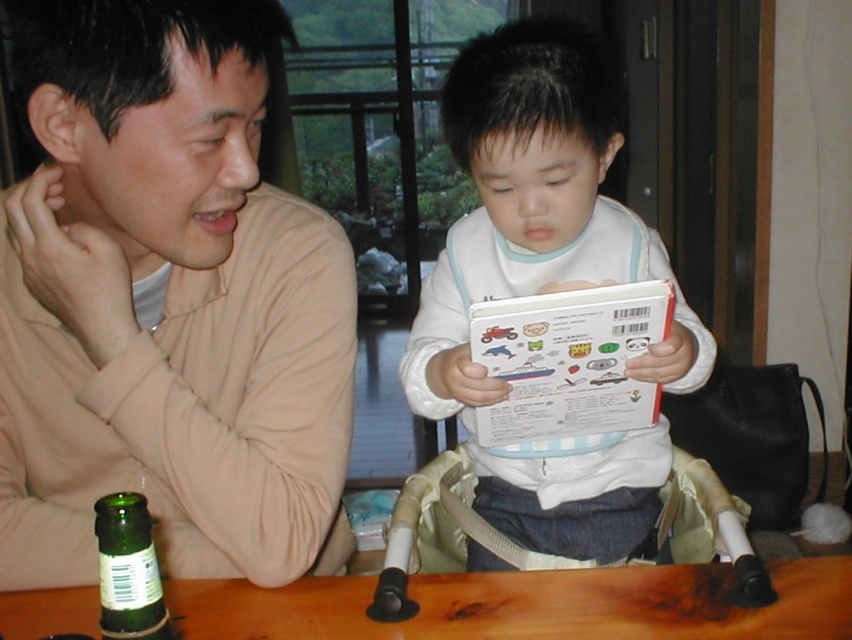
You are a photographer trying to capture a candid shot of the scene. You need to ensure that both the white matte book at center and the wooden table at lower center are clearly visible. Which object should you focus on first to ensure the other remains in focus?

The white matte book at center is positioned over wooden table at lower center. By focusing on the wooden table at lower center, which is further away, the white matte book at center will also be in focus since it is closer to the camera. Alternatively, focusing on the white matte book at center might risk the wooden table at lower center being slightly out of focus due to its distance.

You are a delivery person who needs to place a small package between the wooden table at lower center and the green glass bottle at lower left. Is there enough space for the package if it measures 25 centimeters in length?

The wooden table at lower center is 27.02 centimeters from the green glass bottle at lower left. Since the package is 25 centimeters long, there is sufficient space to place it between them.